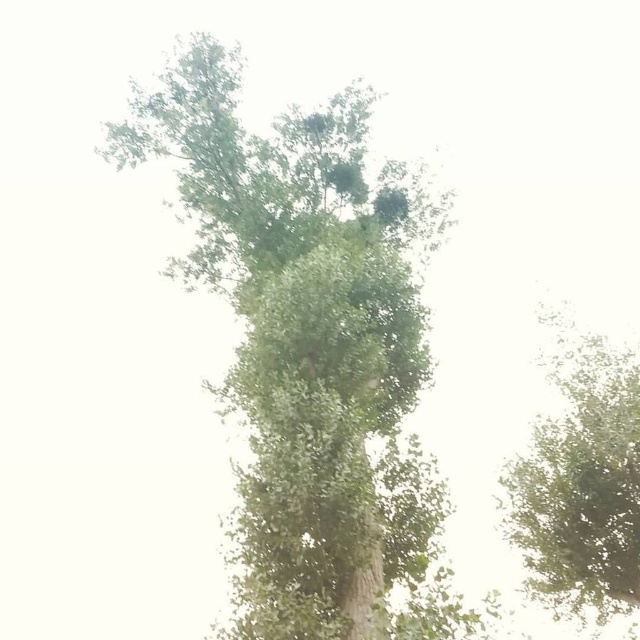
Question: Does green leafy tree at center appear on the left side of green leafy tree at upper center?

Choices:
 (A) yes
 (B) no

Answer: (A)

Question: Is green leafy tree at center bigger than green leafy tree at upper center?

Choices:
 (A) yes
 (B) no

Answer: (B)

Question: Can you confirm if green leafy tree at center is positioned above green leafy tree at upper center?

Choices:
 (A) no
 (B) yes

Answer: (B)

Question: Which of the following is the closest to the observer?

Choices:
 (A) (216, 49)
 (B) (608, 488)

Answer: (B)

Question: Among these objects, which one is farthest from the camera?

Choices:
 (A) green leafy tree at upper center
 (B) green leafy tree at center

Answer: (B)